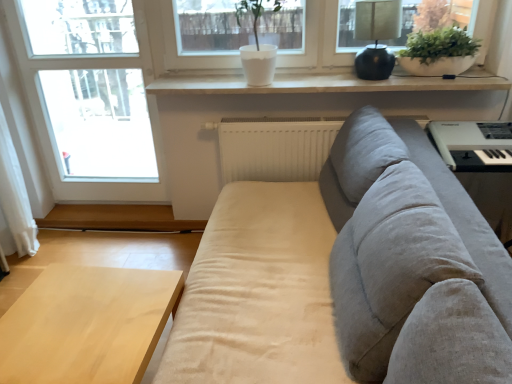
Describe the element at coordinates (55, 126) in the screenshot. This screenshot has width=512, height=384. I see `transparent glass window at left` at that location.

Describe the element at coordinates (325, 83) in the screenshot. The image size is (512, 384). I see `white matte window sill at upper center` at that location.

Measure the distance between point (146, 350) and camera.

Point (146, 350) is 4.30 feet from camera.

At what (x,y) coordinates should I click in order to perform the action: click on matte black lamp at upper right. Please return your answer as a coordinate pair (x, y). The height and width of the screenshot is (384, 512). Looking at the image, I should click on click(x=376, y=36).

Which point is more forward, (422, 72) or (25, 382)?

Positioned in front is point (25, 382).

Is white matte bowl at upper right located outside light wood table at lower left?

Yes, white matte bowl at upper right is outside of light wood table at lower left.

Measure the distance from white matte bowl at upper right to light wood table at lower left.

5.81 feet.

What's the angular difference between white matte bowl at upper right and light wood table at lower left's facing directions?

The angular difference between white matte bowl at upper right and light wood table at lower left is 86.2 degrees.

Is beige fabric couch at center looking in the opposite direction of white matte window sill at upper center?

No, beige fabric couch at center is not facing away from white matte window sill at upper center.

Which object is wider, beige fabric couch at center or white matte window sill at upper center?

beige fabric couch at center is wider.

From a real-world perspective, relative to white matte window sill at upper center, is beige fabric couch at center vertically above or below?

beige fabric couch at center is below white matte window sill at upper center.

Considering the relative positions of beige fabric couch at center and transparent glass window at left in the image provided, is beige fabric couch at center to the right of transparent glass window at left from the viewer's perspective?

Yes.

Is beige fabric couch at center facing away from transparent glass window at left?

No, beige fabric couch at center is not facing away from transparent glass window at left.

Between point (414, 126) and point (61, 196), which one is positioned behind?

The point (61, 196) is farther.

How far apart are beige fabric couch at center and matte black lamp at upper right?

beige fabric couch at center is 88.80 centimeters from matte black lamp at upper right.

At what (x,y) coordinates should I click in order to perform the action: click on lamp above the beige fabric couch at center (from the image's perspective). Please return your answer as a coordinate pair (x, y). The image size is (512, 384). Looking at the image, I should click on (376, 36).

Consider the image. Could you tell me if beige fabric couch at center is facing matte black lamp at upper right?

No, beige fabric couch at center does not turn towards matte black lamp at upper right.

Is beige fabric couch at center thinner than matte black lamp at upper right?

No.

Could you tell me if white matte bowl at upper right is facing matte black lamp at upper right?

No.

Are white matte bowl at upper right and matte black lamp at upper right making contact?

No, white matte bowl at upper right is not in contact with matte black lamp at upper right.

From the image's perspective, between white matte bowl at upper right and matte black lamp at upper right, who is located below?

white matte bowl at upper right is shown below in the image.

Based on the photo, from a real-world perspective, is white matte bowl at upper right positioned over matte black lamp at upper right based on gravity?

No, from a real-world perspective, white matte bowl at upper right is not on top of matte black lamp at upper right.

Is white matte window sill at upper center next to transparent glass window at left and touching it?

No, white matte window sill at upper center is not in contact with transparent glass window at left.

Is point (459, 78) positioned behind point (19, 28)?

No, (459, 78) is closer to viewer.

Is light wood table at lower left positioned with its back to beige fabric couch at center?

Answer: light wood table at lower left does not have its back to beige fabric couch at center.

Considering the positions of objects light wood table at lower left and beige fabric couch at center in the image provided, who is in front, light wood table at lower left or beige fabric couch at center?

beige fabric couch at center is in front.

From the image's perspective, relative to beige fabric couch at center, is light wood table at lower left above or below?

From the image's perspective, light wood table at lower left appears below beige fabric couch at center.

The width and height of the screenshot is (512, 384). Find the location of `table lying below the white matte bowl at upper right (from the image's perspective)`. table lying below the white matte bowl at upper right (from the image's perspective) is located at coordinates (87, 324).

I want to click on window sill lying above the beige fabric couch at center (from the image's perspective), so click(x=325, y=83).

Considering their positions, is light wood table at lower left positioned further to white matte window sill at upper center than white matte bowl at upper right?

Among the two, light wood table at lower left is located further to white matte window sill at upper center.

Based on their spatial positions, is beige fabric couch at center or white matte radiator at center closer to white matte window sill at upper center?

Among the two, white matte radiator at center is located nearer to white matte window sill at upper center.

From the image, which object appears to be nearer to light wood table at lower left, white matte radiator at center or transparent glass window at left?

white matte radiator at center.

Looking at the image, which one is located closer to matte black lamp at upper right, white matte radiator at center or white matte bowl at upper right?

white matte bowl at upper right is positioned closer to the anchor matte black lamp at upper right.

When comparing their distances from white matte bowl at upper right, does white matte radiator at center or white matte window sill at upper center seem closer?

white matte window sill at upper center.

Considering their positions, is transparent glass window at left positioned closer to white matte bowl at upper right than white matte radiator at center?

white matte radiator at center is positioned closer to the anchor white matte bowl at upper right.

Considering their positions, is white matte radiator at center positioned further to white matte window sill at upper center than white matte bowl at upper right?

white matte radiator at center lies further to white matte window sill at upper center than the other object.

When comparing their distances from beige fabric couch at center, does matte black lamp at upper right or white matte bowl at upper right seem further?

Based on the image, white matte bowl at upper right appears to be further to beige fabric couch at center.

You are a GUI agent. You are given a task and a screenshot of the screen. Output one action in this format:
    pyautogui.click(x=<x>, y=<y>)
    Task: Click on the window sill between beige fabric couch at center and transparent glass window at left from front to back
    
    Given the screenshot: What is the action you would take?
    pyautogui.click(x=325, y=83)

The height and width of the screenshot is (384, 512). Find the location of `window sill between white matte radiator at center and white matte bowl at upper right`. window sill between white matte radiator at center and white matte bowl at upper right is located at coordinates (325, 83).

Locate an element on the screen. This screenshot has width=512, height=384. window sill between matte black lamp at upper right and light wood table at lower left from top to bottom is located at coordinates (325, 83).

Where is `window sill that lies between matte black lamp at upper right and white matte radiator at center from top to bottom`? Image resolution: width=512 pixels, height=384 pixels. window sill that lies between matte black lamp at upper right and white matte radiator at center from top to bottom is located at coordinates (325, 83).